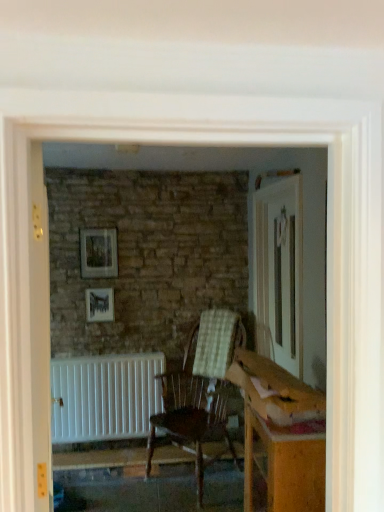
You are a GUI agent. You are given a task and a screenshot of the screen. Output one action in this format:
    pyautogui.click(x=<x>, y=<y>)
    Task: Click on the matte black picture frame at upper center, which is the first picture frame in bottom-to-top order
    The image size is (384, 512).
    Given the screenshot: What is the action you would take?
    pyautogui.click(x=99, y=304)

The image size is (384, 512). Describe the element at coordinates (199, 391) in the screenshot. I see `wooden chair with checkered cushion at center` at that location.

What is the approximate height of wooden frame at upper center, the 2th picture frame when ordered from bottom to top?

The height of wooden frame at upper center, the 2th picture frame when ordered from bottom to top, is 15.73 inches.

Identify the location of matte black picture frame at upper center, which is the first picture frame in bottom-to-top order. (99, 304).

From a real-world perspective, who is located lower, white matte radiator at left or wooden chair with checkered cushion at center?

From a 3D spatial view, wooden chair with checkered cushion at center is below.

Can you confirm if white matte radiator at left is positioned to the left of wooden chair with checkered cushion at center?

Yes, white matte radiator at left is to the left of wooden chair with checkered cushion at center.

Which of these two, white matte radiator at left or wooden chair with checkered cushion at center, is thinner?

Thinner between the two is white matte radiator at left.

From a real-world perspective, which is physically below, wooden frame at upper center, which is counted as the 1th picture frame, starting from the top, or matte black picture frame at upper center, which is the first picture frame in bottom-to-top order?

From a 3D spatial view, matte black picture frame at upper center, which is the first picture frame in bottom-to-top order, is below.

Are wooden frame at upper center, which is counted as the 1th picture frame, starting from the top, and matte black picture frame at upper center, which is the first picture frame in bottom-to-top order, located far from each other?

Actually, wooden frame at upper center, which is counted as the 1th picture frame, starting from the top, and matte black picture frame at upper center, which is the first picture frame in bottom-to-top order, are a little close together.

Is wooden frame at upper center, the 2th picture frame when ordered from bottom to top, facing away from matte black picture frame at upper center, the second picture frame viewed from the top?

wooden frame at upper center, the 2th picture frame when ordered from bottom to top, does not have its back to matte black picture frame at upper center, the second picture frame viewed from the top.

Is wooden frame at upper center, the 2th picture frame when ordered from bottom to top, bigger than matte black picture frame at upper center, which is the first picture frame in bottom-to-top order?

Indeed, wooden frame at upper center, the 2th picture frame when ordered from bottom to top, has a larger size compared to matte black picture frame at upper center, which is the first picture frame in bottom-to-top order.

Considering the sizes of matte black picture frame at upper center, the second picture frame viewed from the top, and wooden chair with checkered cushion at center in the image, is matte black picture frame at upper center, the second picture frame viewed from the top, taller or shorter than wooden chair with checkered cushion at center?

Clearly, matte black picture frame at upper center, the second picture frame viewed from the top, is shorter compared to wooden chair with checkered cushion at center.

From the image's perspective, which one is positioned lower, matte black picture frame at upper center, the second picture frame viewed from the top, or wooden chair with checkered cushion at center?

wooden chair with checkered cushion at center is shown below in the image.

Locate an element on the screen. This screenshot has width=384, height=512. picture frame that is the 1st object above the wooden chair with checkered cushion at center (from a real-world perspective) is located at coordinates (99, 304).

Is point (110, 317) closer to viewer compared to point (207, 367)?

No.

Is matte black picture frame at upper center, which is the first picture frame in bottom-to-top order, aimed at white matte radiator at left?

Yes, matte black picture frame at upper center, which is the first picture frame in bottom-to-top order, is turned towards white matte radiator at left.

Is matte black picture frame at upper center, the second picture frame viewed from the top, outside of white matte radiator at left?

Yes.

From the image's perspective, which one is positioned lower, matte black picture frame at upper center, which is the first picture frame in bottom-to-top order, or white matte radiator at left?

white matte radiator at left appears lower in the image.

From the image's perspective, starting from the white matte radiator at left, which picture frame is the 1st one above? Please provide its 2D coordinates.

[(99, 304)]

Considering the relative positions of wooden chair with checkered cushion at center and matte black picture frame at upper center, which is the first picture frame in bottom-to-top order, in the image provided, is wooden chair with checkered cushion at center in front of matte black picture frame at upper center, which is the first picture frame in bottom-to-top order,?

Yes.

Is matte black picture frame at upper center, which is the first picture frame in bottom-to-top order, a part of wooden chair with checkered cushion at center?

No, matte black picture frame at upper center, which is the first picture frame in bottom-to-top order, is not inside wooden chair with checkered cushion at center.

From the image's perspective, would you say wooden chair with checkered cushion at center is positioned over matte black picture frame at upper center, which is the first picture frame in bottom-to-top order?

Actually, wooden chair with checkered cushion at center appears below matte black picture frame at upper center, which is the first picture frame in bottom-to-top order, in the image.

Does wooden chair with checkered cushion at center have a lesser width compared to matte black picture frame at upper center, the second picture frame viewed from the top?

Incorrect, the width of wooden chair with checkered cushion at center is not less than that of matte black picture frame at upper center, the second picture frame viewed from the top.

How many degrees apart are the facing directions of white matte radiator at lower left and wooden frame at upper center, the 2th picture frame when ordered from bottom to top?

The angle between the facing direction of white matte radiator at lower left and the facing direction of wooden frame at upper center, the 2th picture frame when ordered from bottom to top, is 1.65 degrees.

Between white matte radiator at lower left and wooden frame at upper center, the 2th picture frame when ordered from bottom to top, which one has smaller width?

With smaller width is wooden frame at upper center, the 2th picture frame when ordered from bottom to top.

Does white matte radiator at lower left appear on the right side of wooden frame at upper center, which is counted as the 1th picture frame, starting from the top?

Correct, you'll find white matte radiator at lower left to the right of wooden frame at upper center, which is counted as the 1th picture frame, starting from the top.

Which object is more forward, white matte radiator at lower left or wooden frame at upper center, the 2th picture frame when ordered from bottom to top?

white matte radiator at lower left is closer to the camera.

Is wooden chair with checkered cushion at center oriented towards wooden frame at upper center, the 2th picture frame when ordered from bottom to top?

No, wooden chair with checkered cushion at center is not turned towards wooden frame at upper center, the 2th picture frame when ordered from bottom to top.

From their relative heights in the image, would you say wooden chair with checkered cushion at center is taller or shorter than wooden frame at upper center, the 2th picture frame when ordered from bottom to top?

Clearly, wooden chair with checkered cushion at center is taller compared to wooden frame at upper center, the 2th picture frame when ordered from bottom to top.

From the image's perspective, is wooden chair with checkered cushion at center above or below wooden frame at upper center, which is counted as the 1th picture frame, starting from the top?

wooden chair with checkered cushion at center is situated lower than wooden frame at upper center, which is counted as the 1th picture frame, starting from the top, in the image.

I want to click on chair on the right of white matte radiator at left, so click(x=199, y=391).

Identify the location of picture frame above the matte black picture frame at upper center, the second picture frame viewed from the top (from the image's perspective). 99,253.

Which object lies further to the anchor point white matte radiator at lower left, white matte radiator at left or wooden chair with checkered cushion at center?

white matte radiator at left.

From the image, which object appears to be nearer to matte black picture frame at upper center, which is the first picture frame in bottom-to-top order, white matte radiator at left or wooden frame at upper center, the 2th picture frame when ordered from bottom to top?

The object closer to matte black picture frame at upper center, which is the first picture frame in bottom-to-top order, is wooden frame at upper center, the 2th picture frame when ordered from bottom to top.

Which object lies nearer to the anchor point wooden frame at upper center, the 2th picture frame when ordered from bottom to top, white matte radiator at lower left or white matte radiator at left?

The object closer to wooden frame at upper center, the 2th picture frame when ordered from bottom to top, is white matte radiator at lower left.

Estimate the real-world distances between objects in this image. Which object is further from matte black picture frame at upper center, the second picture frame viewed from the top, white matte radiator at lower left or wooden frame at upper center, the 2th picture frame when ordered from bottom to top?

white matte radiator at lower left is further to matte black picture frame at upper center, the second picture frame viewed from the top.

Considering their positions, is white matte radiator at left positioned further to wooden chair with checkered cushion at center than white matte radiator at lower left?

white matte radiator at left.

When comparing their distances from wooden frame at upper center, the 2th picture frame when ordered from bottom to top, does wooden chair with checkered cushion at center or white matte radiator at left seem closer?

Among the two, wooden chair with checkered cushion at center is located nearer to wooden frame at upper center, the 2th picture frame when ordered from bottom to top.

Considering their positions, is matte black picture frame at upper center, the second picture frame viewed from the top, positioned closer to wooden chair with checkered cushion at center than white matte radiator at lower left?

white matte radiator at lower left.

Estimate the real-world distances between objects in this image. Which object is closer to wooden frame at upper center, which is counted as the 1th picture frame, starting from the top, matte black picture frame at upper center, the second picture frame viewed from the top, or white matte radiator at left?

matte black picture frame at upper center, the second picture frame viewed from the top, is positioned closer to the anchor wooden frame at upper center, which is counted as the 1th picture frame, starting from the top.

Locate an element on the screen. chair between wooden frame at upper center, which is counted as the 1th picture frame, starting from the top, and white matte radiator at lower left, in the vertical direction is located at coordinates (199, 391).

Where is `chair between white matte radiator at left and matte black picture frame at upper center, the second picture frame viewed from the top, in the front-back direction`? The width and height of the screenshot is (384, 512). chair between white matte radiator at left and matte black picture frame at upper center, the second picture frame viewed from the top, in the front-back direction is located at coordinates (199, 391).

Where is `chair located between white matte radiator at left and white matte radiator at lower left in the depth direction`? chair located between white matte radiator at left and white matte radiator at lower left in the depth direction is located at coordinates (199, 391).

Where is `chair located between white matte radiator at left and wooden frame at upper center, the 2th picture frame when ordered from bottom to top, in the depth direction`? chair located between white matte radiator at left and wooden frame at upper center, the 2th picture frame when ordered from bottom to top, in the depth direction is located at coordinates (199, 391).